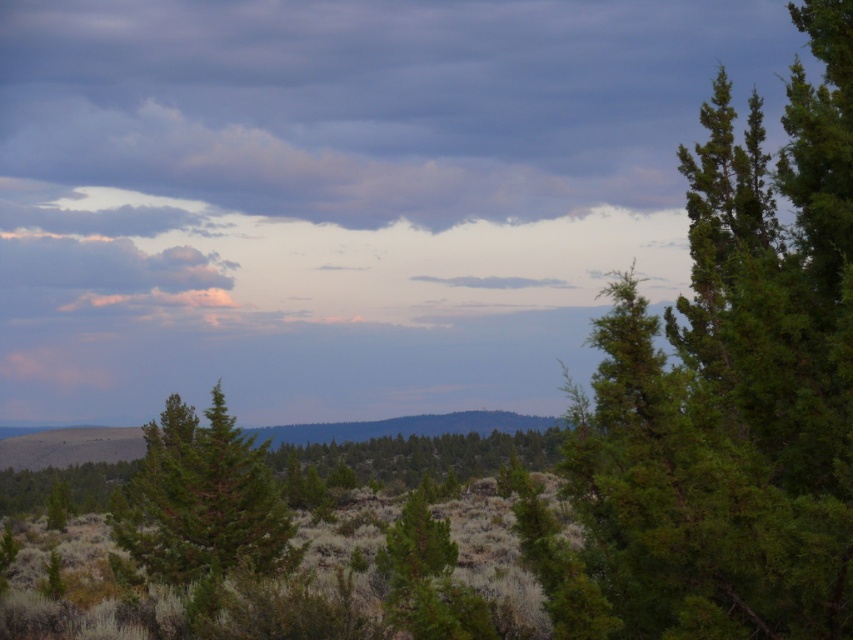
Is green textured tree at right wider than pink fluffy cloud at upper left?

No, green textured tree at right is not wider than pink fluffy cloud at upper left.

Can you confirm if green textured tree at right is shorter than pink fluffy cloud at upper left?

Yes, green textured tree at right is shorter than pink fluffy cloud at upper left.

At what (x,y) coordinates should I click in order to perform the action: click on green textured tree at right. Please return your answer as a coordinate pair (x, y). The image size is (853, 640). Looking at the image, I should click on (735, 387).

Does green textured tree at right appear on the right side of green textured tree at center?

Yes, green textured tree at right is to the right of green textured tree at center.

Consider the image. Which is more to the right, green textured tree at right or green textured tree at center?

green textured tree at right is more to the right.

Is point (741, 436) more distant than point (413, 442)?

No, (741, 436) is closer to viewer.

This screenshot has height=640, width=853. What are the coordinates of `green textured tree at right` in the screenshot? It's located at (735, 387).

Can you confirm if cloudy sky at upper center is positioned above green matte tree at center?

Yes.

Which is in front, point (151, 144) or point (218, 570)?

Point (218, 570) is in front.

Identify the location of cloudy sky at upper center. The image size is (853, 640). (357, 163).